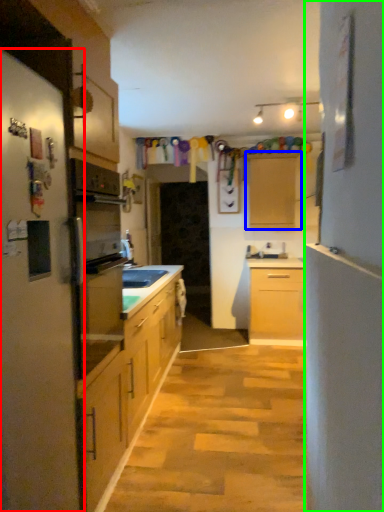
Question: Based on their relative distances, which object is farther from fridge (highlighted by a red box)? Choose from cabinetry (highlighted by a blue box) and side (highlighted by a green box).

Choices:
 (A) cabinetry
 (B) side

Answer: (A)